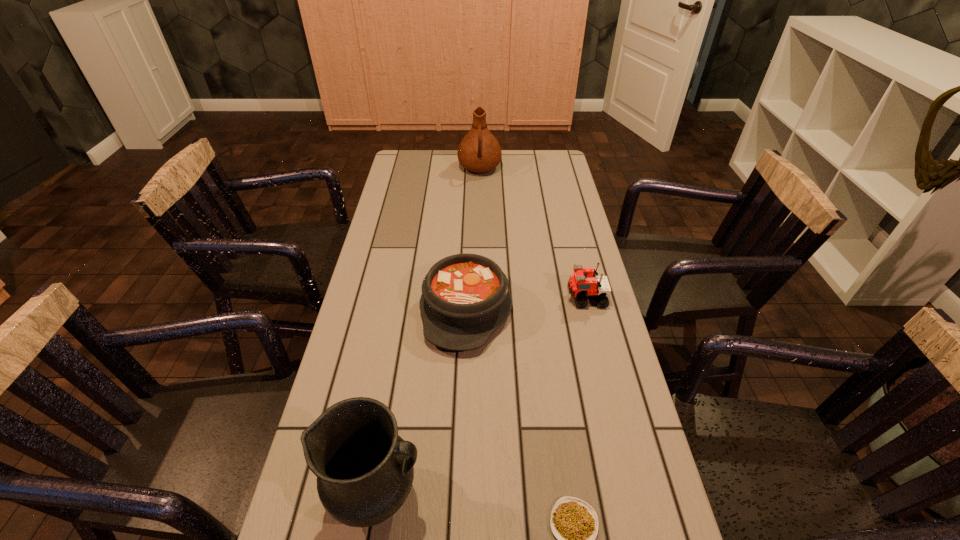
Identify the location of object positioned at the right edge. This screenshot has width=960, height=540. (580, 287).

This screenshot has width=960, height=540. In order to click on vacant space at the far edge of the desktop in this screenshot , I will do `click(453, 154)`.

Where is `vacant space at the left edge of the desktop`? The height and width of the screenshot is (540, 960). vacant space at the left edge of the desktop is located at coordinates (394, 223).

Locate an element on the screen. The height and width of the screenshot is (540, 960). vacant area at the right edge of the desktop is located at coordinates (606, 330).

At what (x,y) coordinates should I click in order to perform the action: click on vacant region at the far left corner. Please return your answer as a coordinate pair (x, y). Looking at the image, I should click on (404, 162).

Find the location of a particular element. Image resolution: width=960 pixels, height=540 pixels. vacant point located between the farthest object and the casserole is located at coordinates (473, 238).

Image resolution: width=960 pixels, height=540 pixels. I want to click on vacant space that's between the casserole and the right pitcher, so click(x=473, y=238).

At what (x,y) coordinates should I click in order to perform the action: click on free spot between the rightmost object and the casserole. Please return your answer as a coordinate pair (x, y). Image resolution: width=960 pixels, height=540 pixels. Looking at the image, I should click on (526, 303).

The height and width of the screenshot is (540, 960). In order to click on free spot between the farthest object and the rightmost object in this screenshot , I will do `click(533, 233)`.

Locate which object is the closest to the nearer pitcher. Please provide its 2D coordinates. Your answer should be formatted as a tuple, i.e. [(x, y)], where the tuple contains the x and y coordinates of a point satisfying the conditions above.

[(574, 522)]